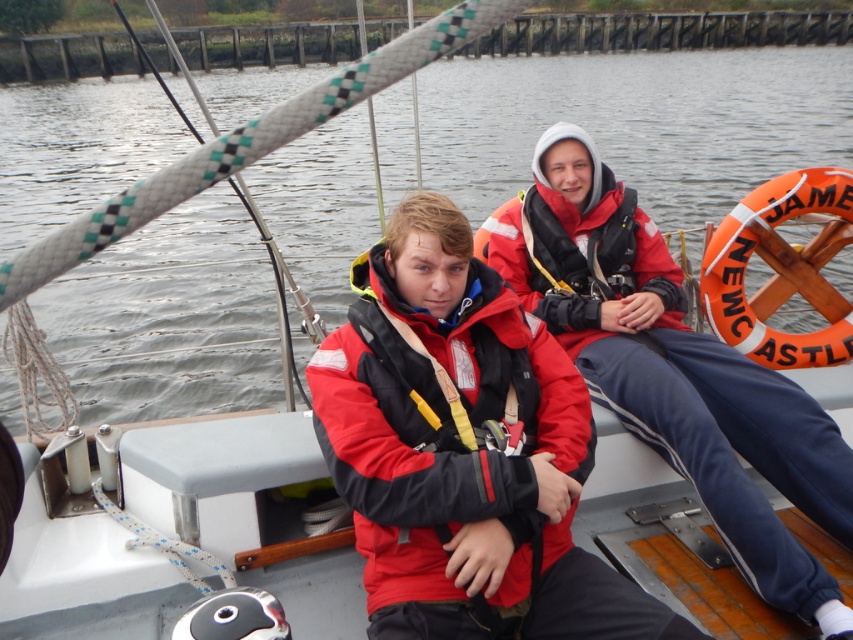
Does red matte life jacket at center have a larger size compared to red matte life jacket at upper right?

No, red matte life jacket at center is not bigger than red matte life jacket at upper right.

Does point (357, 474) come closer to viewer compared to point (607, 196)?

Yes, point (357, 474) is in front of point (607, 196).

Find the location of a particular element. red matte life jacket at center is located at coordinates (444, 432).

Is red matte jacket at right taller than red matte life jacket at center?

Indeed, red matte jacket at right has a greater height compared to red matte life jacket at center.

Can you confirm if red matte jacket at right is bigger than red matte life jacket at center?

Correct, red matte jacket at right is larger in size than red matte life jacket at center.

Is point (836, 480) closer to viewer compared to point (424, 444)?

No, (836, 480) is further to viewer.

This screenshot has height=640, width=853. I want to click on red matte jacket at right, so click(676, 372).

Based on the photo, does red matte jacket at right have a greater height compared to red matte life jacket at upper right?

Yes.

Can you confirm if red matte jacket at right is smaller than red matte life jacket at upper right?

No.

Between point (677, 328) and point (509, 248), which one is positioned in front?

Point (677, 328) is in front.

In order to click on red matte jacket at right in this screenshot , I will do `click(676, 372)`.